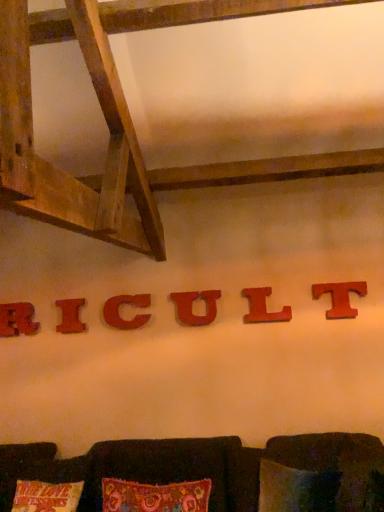
Question: Is red matte letter l at center, the second alphabet from the right, not within red wood letter t at center right, which is counted as the first alphabet, starting from the right?

Choices:
 (A) no
 (B) yes

Answer: (B)

Question: Would you consider red matte letter l at center, the fifth alphabet viewed from the left, to be distant from red wood letter t at center right, which is counted as the sixth alphabet, starting from the left?

Choices:
 (A) no
 (B) yes

Answer: (A)

Question: From a real-world perspective, is red matte letter l at center, the fifth alphabet viewed from the left, on top of red wood letter t at center right, which is counted as the sixth alphabet, starting from the left?

Choices:
 (A) yes
 (B) no

Answer: (B)

Question: Is red matte letter l at center, the second alphabet from the right, positioned in front of red wood letter t at center right, which is counted as the first alphabet, starting from the right?

Choices:
 (A) yes
 (B) no

Answer: (B)

Question: From a real-world perspective, does red matte letter l at center, the fifth alphabet viewed from the left, sit lower than red wood letter t at center right, which is counted as the first alphabet, starting from the right?

Choices:
 (A) yes
 (B) no

Answer: (A)

Question: Could red wood letter t at center right, which is counted as the first alphabet, starting from the right, be considered to be inside red matte letter l at center, the second alphabet from the right?

Choices:
 (A) yes
 (B) no

Answer: (B)

Question: Is red matte letter l at center, the second alphabet from the right, positioned far away from wooden letter r at center, which appears as the 6th alphabet when viewed from the right?

Choices:
 (A) no
 (B) yes

Answer: (B)

Question: Does red matte letter l at center, the fifth alphabet viewed from the left, come behind wooden letter r at center, which appears as the 6th alphabet when viewed from the right?

Choices:
 (A) no
 (B) yes

Answer: (A)

Question: From a real-world perspective, is red matte letter l at center, the fifth alphabet viewed from the left, below wooden letter r at center, which appears as the 6th alphabet when viewed from the right?

Choices:
 (A) yes
 (B) no

Answer: (A)

Question: Is the position of red matte letter l at center, the fifth alphabet viewed from the left, less distant than that of wooden letter r at center, which ranks as the first alphabet in left-to-right order?

Choices:
 (A) no
 (B) yes

Answer: (B)

Question: Is wooden letter r at center, which ranks as the first alphabet in left-to-right order, surrounded by red matte letter l at center, the fifth alphabet viewed from the left?

Choices:
 (A) no
 (B) yes

Answer: (A)

Question: Could you tell me if red matte letter l at center, the fifth alphabet viewed from the left, is turned towards wooden letter r at center, which appears as the 6th alphabet when viewed from the right?

Choices:
 (A) yes
 (B) no

Answer: (B)

Question: Is brown fabric couch at lower center closer to the viewer compared to red matte letter l at center, the second alphabet from the right?

Choices:
 (A) yes
 (B) no

Answer: (A)